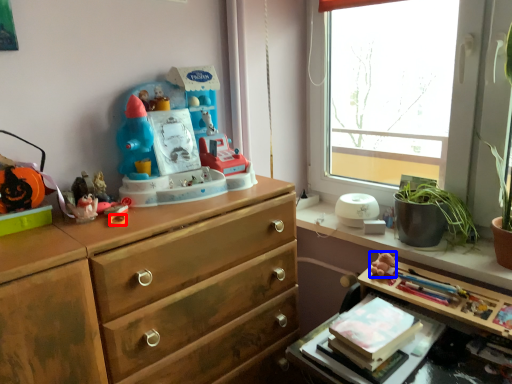
Question: Which point is further to the camera, knob (highlighted by a red box) or miniature (highlighted by a blue box)?

Choices:
 (A) knob
 (B) miniature

Answer: (B)